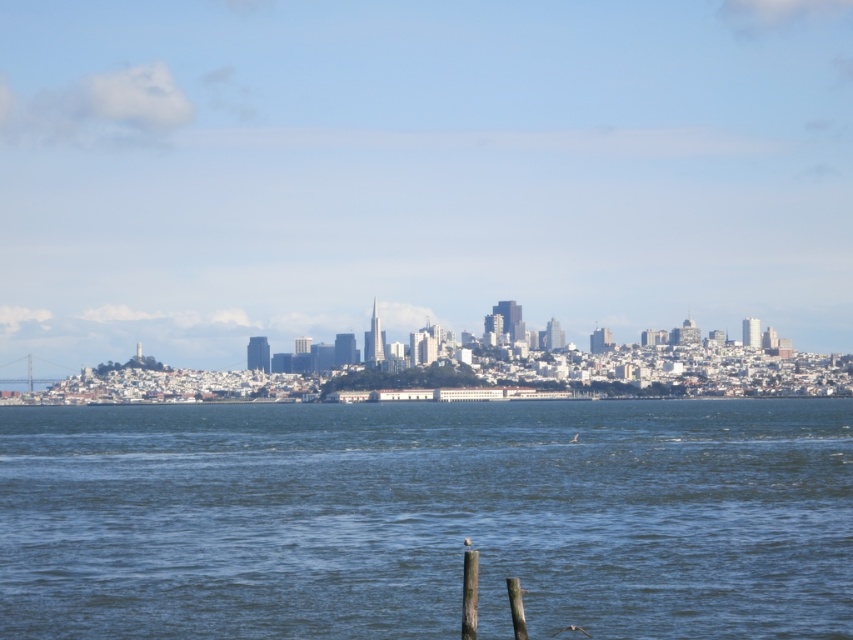
You are a photographer planning to capture the entire city skyline in your shot. You notice the blue water at center and the smooth wood post at lower center in your viewfinder. Which object should you prioritize framing to ensure the city skyline remains the main focus?

You should prioritize framing the blue water at center because it is larger than the smooth wood post at lower center, allowing more space for the city skyline to be the main focus.

Consider the image. You are standing at the edge of the water looking out at the city skyline. There are two points marked in the scene, one at coordinates point (163, 412) and the other at point (466, 573). Which of these two points is closer to you?

Point (163, 412) is closer to you because it is further to the viewer than point (466, 573).

You are a delivery drone with a wingspan of 1.2 meters. You need to fly from the smooth wood post at lower center to the Transamerica Pyramid in the city skyline. The path must stay above the blue water at center. Can you safely navigate this route without hitting any obstacles?

The distance between the smooth wood post at lower center and blue water at center is 244.47 meters. Since the drone must fly above the blue water at center, there are no obstacles mentioned in the scene description, so the drone can safely navigate the route.